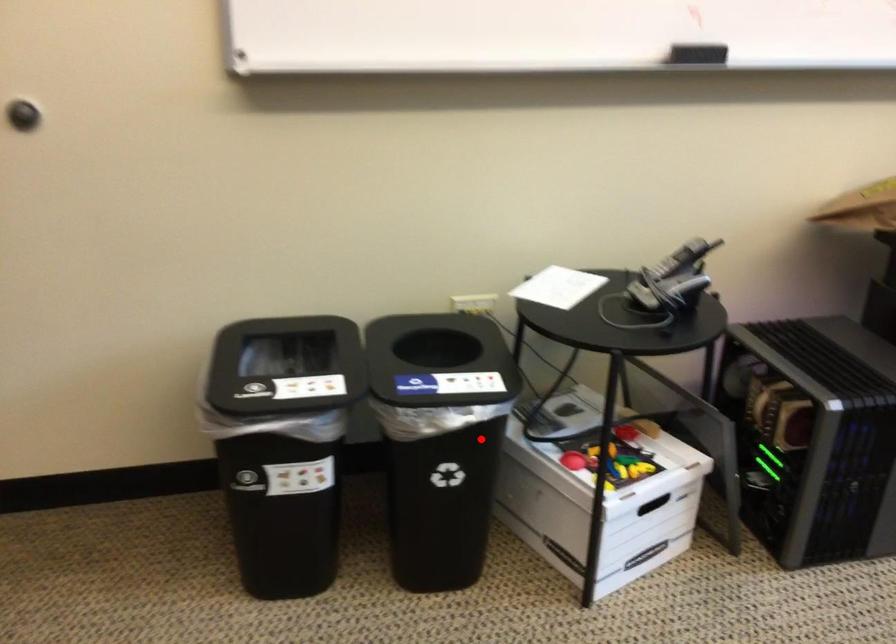
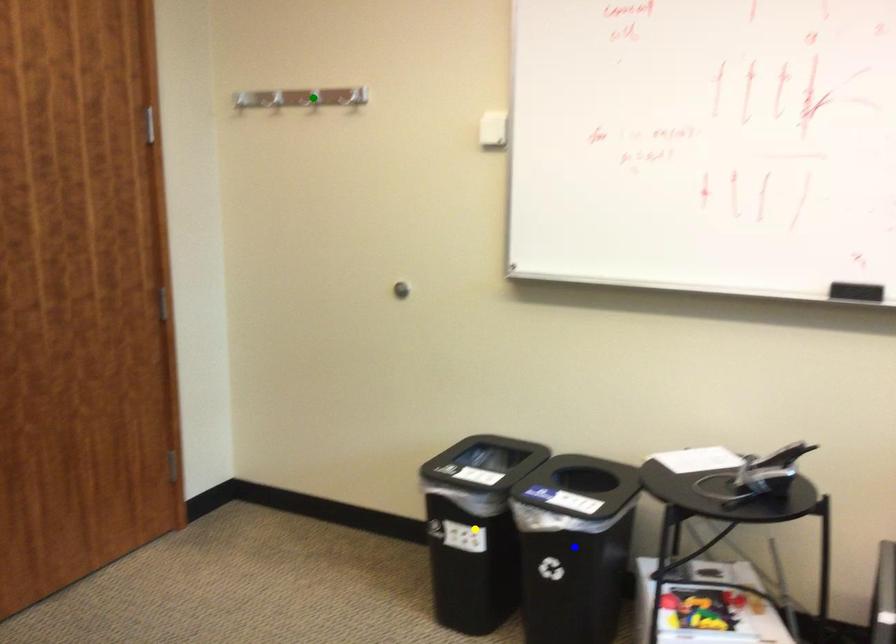
Question: I am providing you with two images of the same scene from different viewpoints. A red point is marked on the first image. You are given multiple points on the second image. Which point in image 2 represents the same 3d spot as the red point in image 1?

Choices:
 (A) green point
 (B) blue point
 (C) yellow point

Answer: (B)